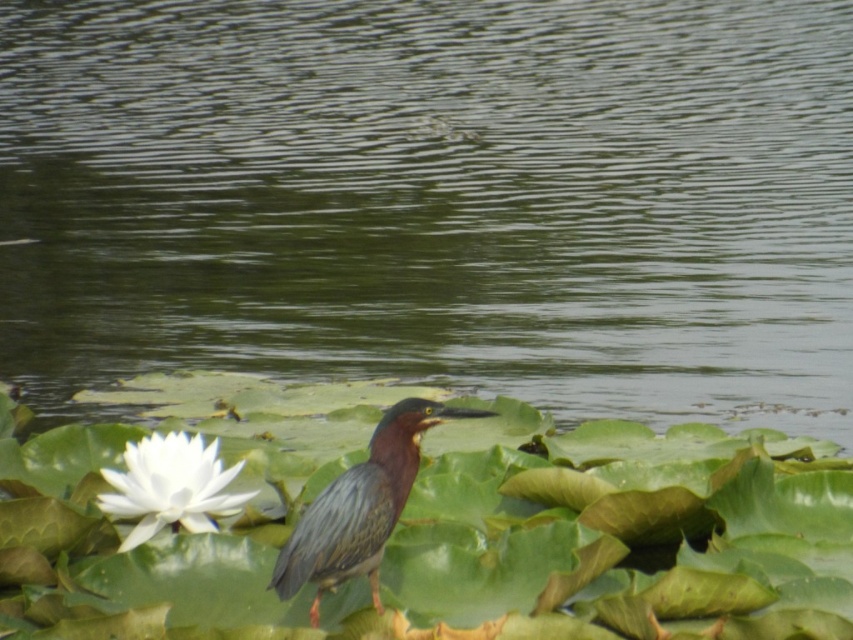
Question: Estimate the real-world distances between objects in this image. Which object is closer to the green glossy heron at center?

Choices:
 (A) white matte flower at lower left
 (B) greenish water at center

Answer: (A)

Question: Does green glossy heron at center appear under white matte flower at lower left?

Choices:
 (A) no
 (B) yes

Answer: (A)

Question: Is greenish water at center wider than green glossy heron at center?

Choices:
 (A) no
 (B) yes

Answer: (B)

Question: Among these objects, which one is farthest from the camera?

Choices:
 (A) greenish water at center
 (B) white matte flower at lower left
 (C) green glossy heron at center

Answer: (A)

Question: Which object appears closest to the camera in this image?

Choices:
 (A) white matte flower at lower left
 (B) green glossy heron at center
 (C) greenish water at center

Answer: (B)

Question: Is greenish water at center closer to the viewer compared to white matte flower at lower left?

Choices:
 (A) no
 (B) yes

Answer: (A)